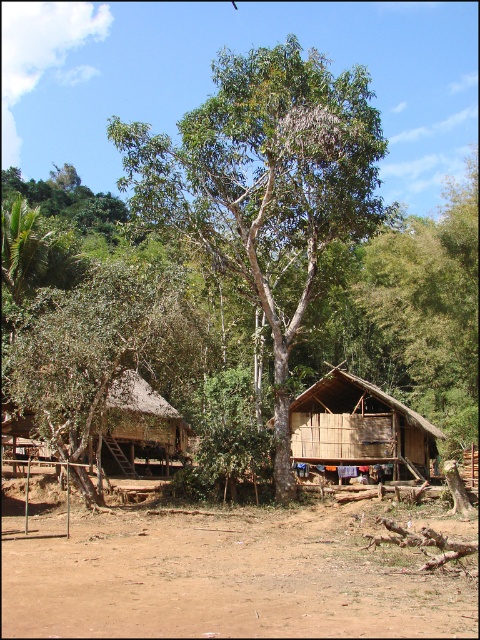
Between point (379, 444) and point (144, 394), which one is positioned behind?

Positioned behind is point (144, 394).

Between point (309, 420) and point (124, 472), which one is positioned in front?

Point (309, 420)

The width and height of the screenshot is (480, 640). Identify the location of bamboo hut at center. (358, 429).

Can you confirm if green leafy tree at center is wider than bamboo hut at center?

Yes.

Can you confirm if green leafy tree at center is bigger than bamboo hut at center?

Indeed, green leafy tree at center has a larger size compared to bamboo hut at center.

Between point (154, 156) and point (433, 436), which one is positioned behind?

Point (433, 436)

The height and width of the screenshot is (640, 480). Find the location of `green leafy tree at center`. green leafy tree at center is located at coordinates (264, 186).

Who is lower down, brown sandy ground at center or brown thatched hut at left?

Positioned lower is brown thatched hut at left.

What do you see at coordinates (229, 579) in the screenshot?
I see `brown sandy ground at center` at bounding box center [229, 579].

Where is `brown sandy ground at center`? The height and width of the screenshot is (640, 480). brown sandy ground at center is located at coordinates [x=229, y=579].